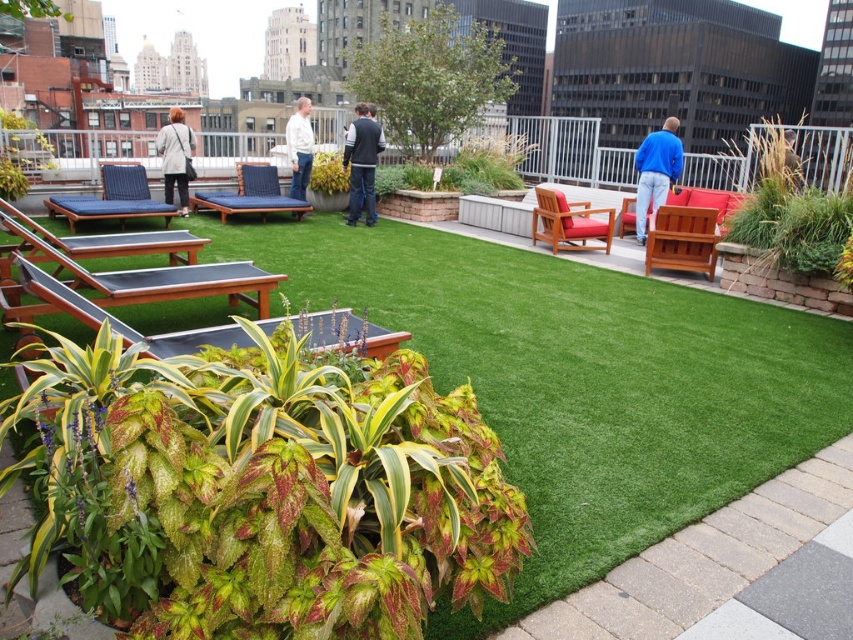
You are standing on the rooftop garden and want to water the variegated leafy plant at lower left. Your watering can has a maximum reach of 5 feet. Can you water it without moving closer?

The variegated leafy plant at lower left is 4.94 feet away from the viewer, which is within the watering can maximum reach of 5 feet. Yes, you can water it without moving closer.

You are designing a garden layout and want to place a small statue between the variegated leafy plant at lower left and the green artificial turf at center. Considering their heights, which object will the statue be closer to in terms of height?

The variegated leafy plant at lower left is much taller than the green artificial turf at center, so the statue will be closer in height to the green artificial turf at center.

You are standing at point (338, 170) and want to walk to the rooftop garden entrance located at point (71, 449). Is the entrance directly in front of you?

Yes, the entrance at point (71, 449) is directly in front of you because it is positioned in front of your current location at point (338, 170).